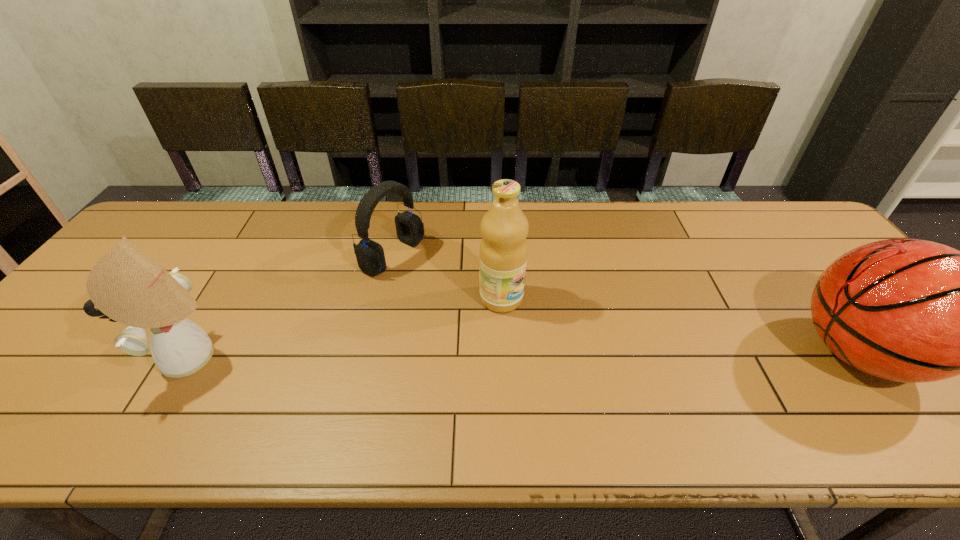
You are a GUI agent. You are given a task and a screenshot of the screen. Output one action in this format:
    pyautogui.click(x=<x>, y=<y>)
    Task: Click on the vacant area that lies between the olive oil and the farthest object
    
    Given the screenshot: What is the action you would take?
    pyautogui.click(x=447, y=277)

This screenshot has height=540, width=960. Find the location of `vacant area between the olive oil and the doll`. vacant area between the olive oil and the doll is located at coordinates (348, 328).

This screenshot has width=960, height=540. I want to click on free spot between the third object from left to right and the shortest object, so click(x=447, y=277).

This screenshot has height=540, width=960. I want to click on free space that is in between the leftmost object and the farthest object, so click(294, 307).

Identify the location of free spot between the second object from right to left and the doll. (348, 328).

This screenshot has height=540, width=960. Identify the location of object that is the closest to the second object from left to right. (504, 227).

Find the location of a particular element. object that is the third closest one to the second object from right to left is located at coordinates (907, 310).

Identify the location of free location that satisfies the following two spatial constraints: 1. on the front side of the second object from left to right; 2. on the left side of the olive oil. The height and width of the screenshot is (540, 960). [x=383, y=299].

The image size is (960, 540). In order to click on free space that satisfies the following two spatial constraints: 1. on the front side of the second object from right to left; 2. on the right side of the farthest object in this screenshot , I will do `click(383, 299)`.

At what (x,y) coordinates should I click in order to perform the action: click on free location that satisfies the following two spatial constraints: 1. on the front side of the olive oil; 2. on the right side of the second object from left to right. Please return your answer as a coordinate pair (x, y). Looking at the image, I should click on (383, 299).